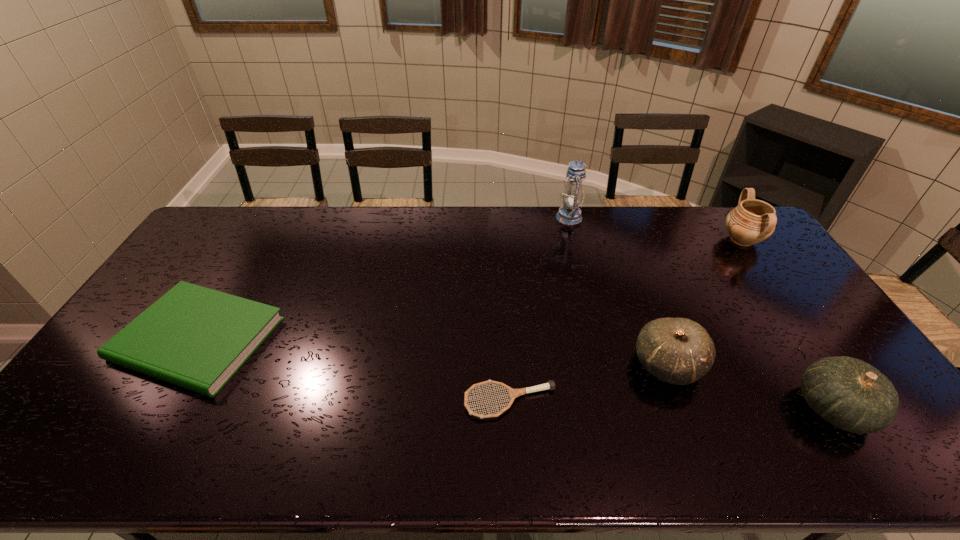
Where is `urn that is at the far edge`? This screenshot has width=960, height=540. urn that is at the far edge is located at coordinates point(752,221).

Locate an element on the screen. The height and width of the screenshot is (540, 960). object at the near edge is located at coordinates (850, 394).

Where is `object located in the left edge section of the desktop`? The width and height of the screenshot is (960, 540). object located in the left edge section of the desktop is located at coordinates [197, 338].

The height and width of the screenshot is (540, 960). Find the location of `urn present at the right edge`. urn present at the right edge is located at coordinates (752, 221).

At what (x,y) coordinates should I click in order to perform the action: click on gourd that is at the right edge. Please return your answer as a coordinate pair (x, y). Looking at the image, I should click on (850, 394).

I want to click on object present at the far right corner, so click(x=752, y=221).

Find the location of a particular element. The height and width of the screenshot is (540, 960). object that is at the near right corner is located at coordinates (850, 394).

Image resolution: width=960 pixels, height=540 pixels. Find the location of `vacant area at the far edge of the desktop`. vacant area at the far edge of the desktop is located at coordinates (477, 219).

This screenshot has height=540, width=960. What are the coordinates of `free space between the left gourd and the leftmost object` in the screenshot? It's located at (433, 352).

Where is `empty space that is in between the second shortest object and the fifth object from right to left`? Image resolution: width=960 pixels, height=540 pixels. empty space that is in between the second shortest object and the fifth object from right to left is located at coordinates (354, 370).